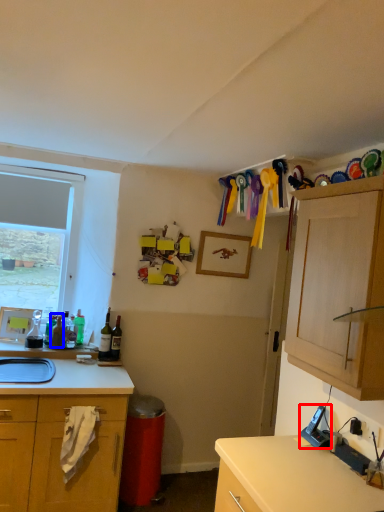
Question: Which point is further to the camera, appliance (highlighted by a red box) or bottle (highlighted by a blue box)?

Choices:
 (A) appliance
 (B) bottle

Answer: (B)